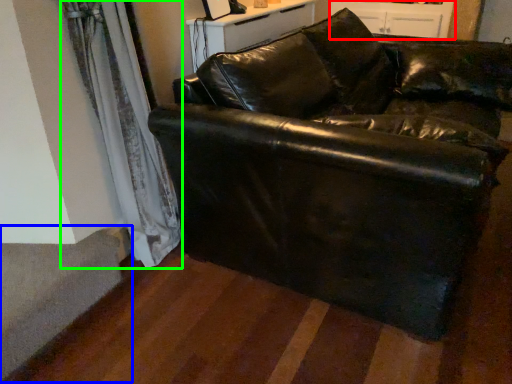
Question: Which object is the closest to the dresser (highlighted by a red box)? Choose among these: stairwell (highlighted by a blue box) or curtain (highlighted by a green box).

Choices:
 (A) stairwell
 (B) curtain

Answer: (B)